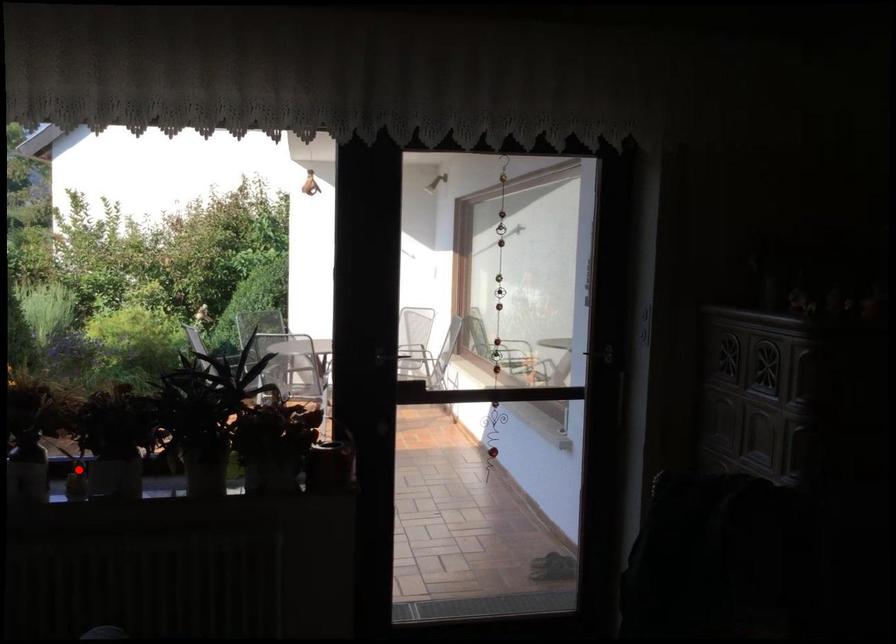
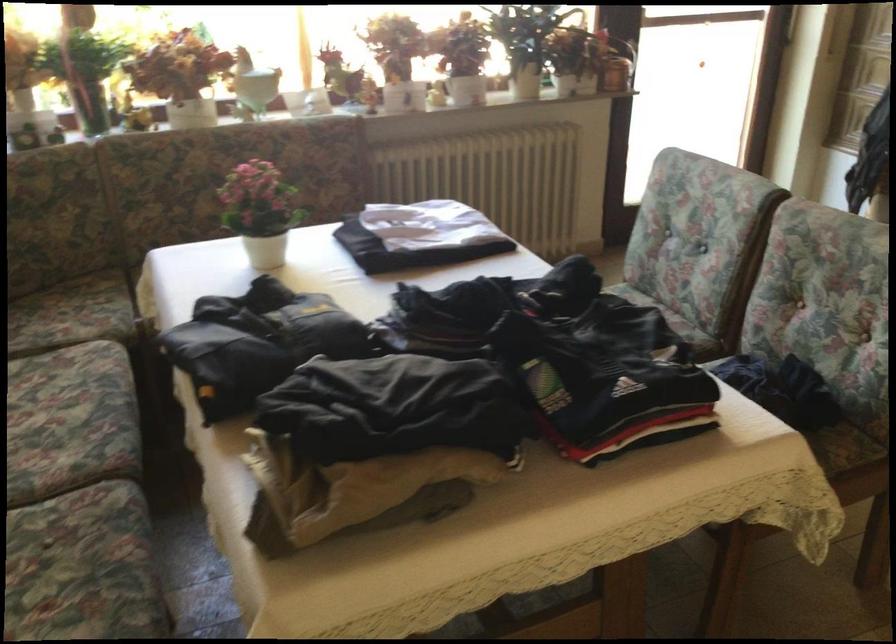
The point at the highlighted location is marked in the first image. Where is the corresponding point in the second image?

(467, 84)